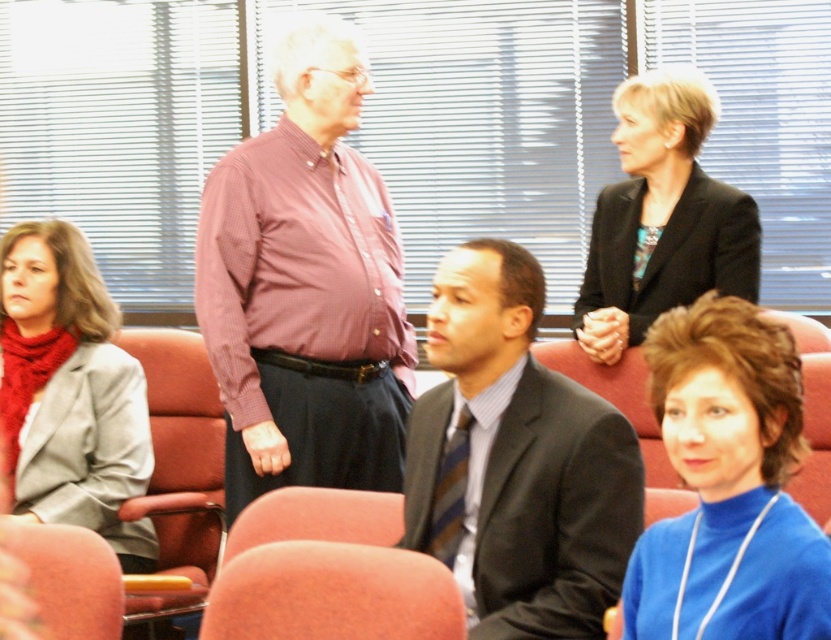
Does dark gray suit at center have a greater height compared to black matte blazer at upper right?

No, dark gray suit at center is not taller than black matte blazer at upper right.

Is dark gray suit at center thinner than black matte blazer at upper right?

Yes, dark gray suit at center is thinner than black matte blazer at upper right.

Does point (554, 598) come farther from viewer compared to point (675, 93)?

No, it is in front of (675, 93).

Where is `dark gray suit at center`? The width and height of the screenshot is (831, 640). dark gray suit at center is located at coordinates (515, 460).

Does black matte blazer at upper right have a lesser height compared to orange fabric chair at lower center?

No, black matte blazer at upper right is not shorter than orange fabric chair at lower center.

Can you confirm if black matte blazer at upper right is bigger than orange fabric chair at lower center?

Correct, black matte blazer at upper right is larger in size than orange fabric chair at lower center.

Locate an element on the screen. black matte blazer at upper right is located at coordinates (662, 216).

Which of these two, dark gray suit at center or velvet-like pink chair at lower left, stands taller?

dark gray suit at center is taller.

Is point (632, 477) behind point (58, 548)?

Yes, it is behind point (58, 548).

This screenshot has width=831, height=640. What do you see at coordinates (515, 460) in the screenshot?
I see `dark gray suit at center` at bounding box center [515, 460].

The image size is (831, 640). Find the location of `dark gray suit at center`. dark gray suit at center is located at coordinates (515, 460).